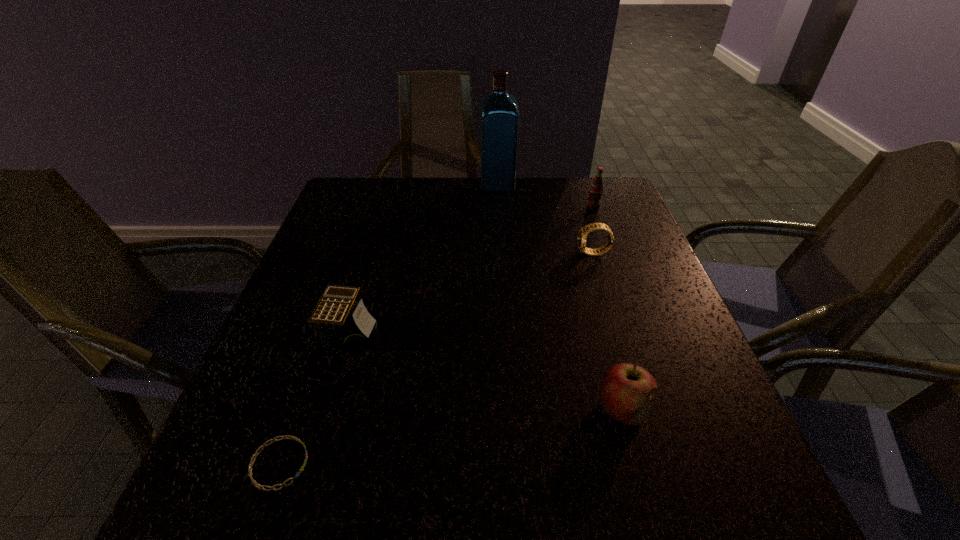
Find the location of a particular element. vacant space located 0.360m on the flat label side of the farthest object is located at coordinates (363, 185).

At what (x,y) coordinates should I click in order to perform the action: click on vacant space located on the flat label side of the farthest object. Please return your answer as a coordinate pair (x, y). The width and height of the screenshot is (960, 540). Looking at the image, I should click on (392, 185).

This screenshot has width=960, height=540. I want to click on vacant area situated on the front of the fifth shortest object, so (620, 281).

You are a GUI agent. You are given a task and a screenshot of the screen. Output one action in this format:
    pyautogui.click(x=<x>, y=<y>)
    Task: Click on the vacant space located 0.070m on the back of the fifth farthest object
    Image resolution: width=960 pixels, height=540 pixels.
    Given the screenshot: What is the action you would take?
    pyautogui.click(x=608, y=355)

Locate an element on the screen. The height and width of the screenshot is (540, 960). vacant space positioned on the back of the calculator is located at coordinates (385, 219).

The width and height of the screenshot is (960, 540). Find the location of `free region located 0.100m on the face of the watch`. free region located 0.100m on the face of the watch is located at coordinates (537, 253).

Locate an element on the screen. The height and width of the screenshot is (540, 960). blank space located 0.240m on the face of the watch is located at coordinates (480, 253).

Locate an element on the screen. free space located on the face of the watch is located at coordinates (452, 253).

Locate an element on the screen. This screenshot has height=540, width=960. free spot located 0.150m on the surface of the bracelet showing star-shaped elements is located at coordinates (403, 464).

Locate an element on the screen. liquor that is at the far edge is located at coordinates (499, 110).